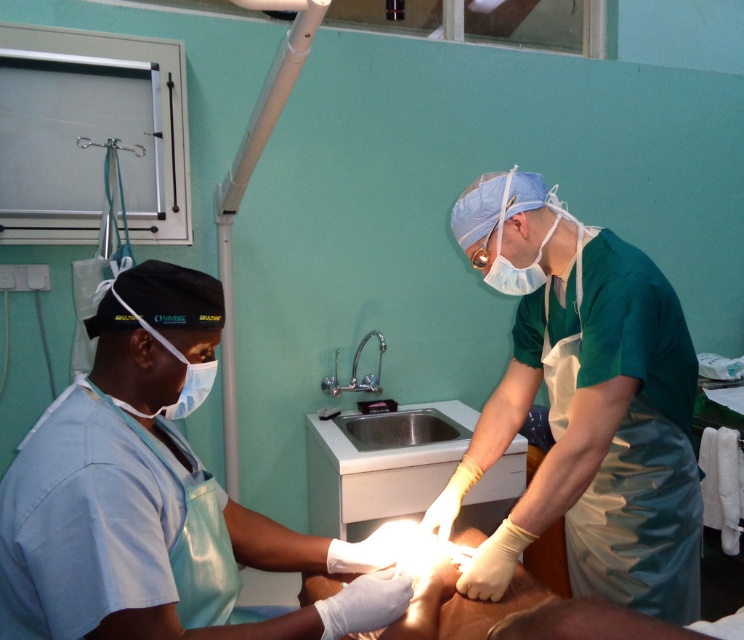
Does point (343, 618) come closer to viewer compared to point (509, 196)?

Yes.

Is blue surgical gown at center behind green matte surgical gown at center?

No, blue surgical gown at center is closer to the viewer.

The width and height of the screenshot is (744, 640). What do you see at coordinates (150, 496) in the screenshot? I see `blue surgical gown at center` at bounding box center [150, 496].

The width and height of the screenshot is (744, 640). I want to click on blue surgical gown at center, so click(150, 496).